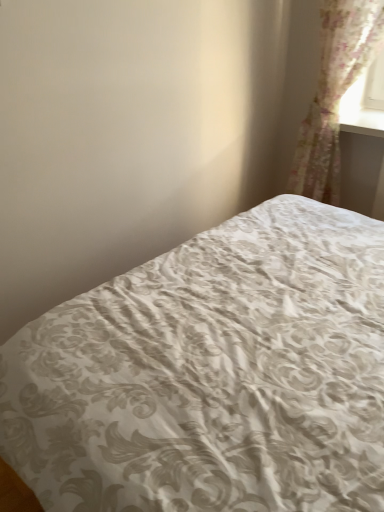
Question: Is white damask fabric bed at center to the left or to the right of translucent floral fabric at upper right in the image?

Choices:
 (A) right
 (B) left

Answer: (B)

Question: Is white damask fabric bed at center bigger or smaller than translucent floral fabric at upper right?

Choices:
 (A) big
 (B) small

Answer: (A)

Question: From the image's perspective, is white damask fabric bed at center located above or below translucent floral fabric at upper right?

Choices:
 (A) below
 (B) above

Answer: (A)

Question: Would you say translucent floral fabric at upper right is inside or outside white damask fabric bed at center?

Choices:
 (A) outside
 (B) inside

Answer: (A)

Question: In terms of size, does translucent floral fabric at upper right appear bigger or smaller than white damask fabric bed at center?

Choices:
 (A) big
 (B) small

Answer: (B)

Question: From their relative heights in the image, would you say translucent floral fabric at upper right is taller or shorter than white damask fabric bed at center?

Choices:
 (A) tall
 (B) short

Answer: (A)

Question: From a real-world perspective, is translucent floral fabric at upper right physically located above or below white damask fabric bed at center?

Choices:
 (A) above
 (B) below

Answer: (A)